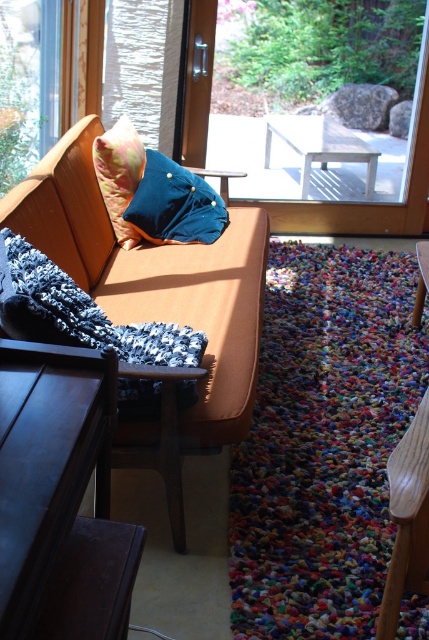
Does dark wood table at lower left have a greater width compared to transparent glass door at upper center?

Incorrect, dark wood table at lower left's width does not surpass transparent glass door at upper center's.

Which is more to the left, dark wood table at lower left or transparent glass door at upper center?

dark wood table at lower left is more to the left.

Who is more forward, (6, 387) or (317, 205)?

Point (6, 387) is more forward.

This screenshot has height=640, width=429. What are the coordinates of `dark wood table at lower left` in the screenshot? It's located at (60, 497).

Does matte glass screen door at upper center have a smaller size compared to wooden table at center?

No, matte glass screen door at upper center is not smaller than wooden table at center.

Based on the photo, does matte glass screen door at upper center have a greater height compared to wooden table at center?

Indeed, matte glass screen door at upper center has a greater height compared to wooden table at center.

Does point (190, 51) come closer to viewer compared to point (201, 170)?

No, it is behind (201, 170).

Image resolution: width=429 pixels, height=640 pixels. Find the location of `matte glass screen door at upper center`. matte glass screen door at upper center is located at coordinates (198, 83).

Does transparent glass window at upper left have a greater width compared to transparent glass door at upper center?

No, transparent glass window at upper left is not wider than transparent glass door at upper center.

Can you confirm if transparent glass window at upper left is taller than transparent glass door at upper center?

In fact, transparent glass window at upper left may be shorter than transparent glass door at upper center.

Measure the distance between transparent glass window at upper left and camera.

transparent glass window at upper left and camera are 8.60 feet apart from each other.

Where is `transparent glass window at upper left`? transparent glass window at upper left is located at coordinates (27, 84).